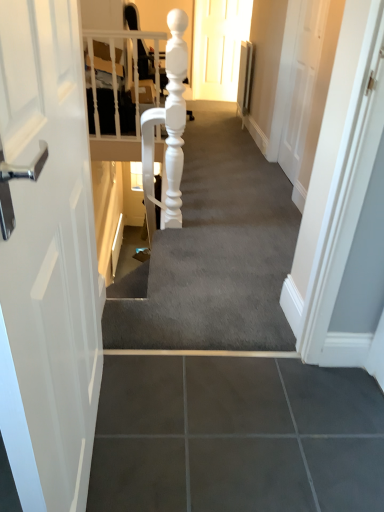
Question: Can you confirm if matte white door at upper center is bigger than smooth gray carpet at center?

Choices:
 (A) no
 (B) yes

Answer: (A)

Question: Considering the relative positions of matte white door at upper center and smooth gray carpet at center in the image provided, is matte white door at upper center to the left of smooth gray carpet at center from the viewer's perspective?

Choices:
 (A) yes
 (B) no

Answer: (B)

Question: From the image's perspective, would you say matte white door at upper center is positioned over smooth gray carpet at center?

Choices:
 (A) no
 (B) yes

Answer: (B)

Question: Is matte white door at upper center placed right next to smooth gray carpet at center?

Choices:
 (A) yes
 (B) no

Answer: (B)

Question: Is matte white door at upper center completely or partially outside of smooth gray carpet at center?

Choices:
 (A) no
 (B) yes

Answer: (B)

Question: Is matte white door at upper center facing towards smooth gray carpet at center?

Choices:
 (A) no
 (B) yes

Answer: (B)

Question: Is smooth gray carpet at center further to camera compared to matte white door at upper center?

Choices:
 (A) no
 (B) yes

Answer: (A)

Question: Can you see smooth gray carpet at center touching matte white door at upper center?

Choices:
 (A) yes
 (B) no

Answer: (B)

Question: Considering the relative sizes of smooth gray carpet at center and matte white door at upper center in the image provided, is smooth gray carpet at center bigger than matte white door at upper center?

Choices:
 (A) no
 (B) yes

Answer: (B)

Question: Is smooth gray carpet at center taller than matte white door at upper center?

Choices:
 (A) yes
 (B) no

Answer: (B)

Question: From the image's perspective, does smooth gray carpet at center appear higher than matte white door at upper center?

Choices:
 (A) yes
 (B) no

Answer: (B)

Question: Does smooth gray carpet at center contain matte white door at upper center?

Choices:
 (A) yes
 (B) no

Answer: (B)

Question: Is matte white door at upper center bigger or smaller than smooth gray carpet at center?

Choices:
 (A) small
 (B) big

Answer: (A)